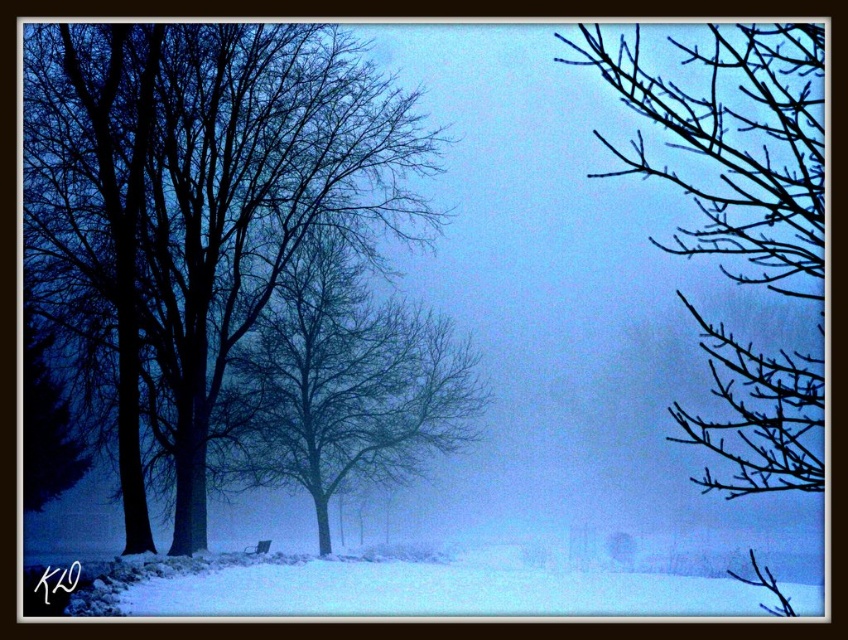
You are an artist planning to paint the winter scene. You want to ensure the black matte tree at left and the bare branches at center are proportionate. Which object should you paint taller in your artwork?

The black matte tree at left should be painted taller than the bare branches at center because it has a greater height in the scene.

You are standing in the winter scene described. You want to place a small decorative snowman exactly at point (765, 81). If your current position is 50 feet away from that point, can you walk straight to it without any obstacles?

The distance of point (765, 81) from viewer is 60.02 feet. Since you are currently 50 feet away, you are not yet at the point. To reach it, you would need to walk an additional 10.02 feet forward. However, the scene description does not mention any obstacles between your current position and the point, so assuming the path is clear, you can proceed.

You are an artist sketching this winter scene. You want to draw the black matte tree at left and the bare branches at center accurately. Which one should you sketch first to ensure proper layering?

The black matte tree at left is in front of bare branches at center, so you should sketch the black matte tree at left first to establish the foreground before adding the background elements.